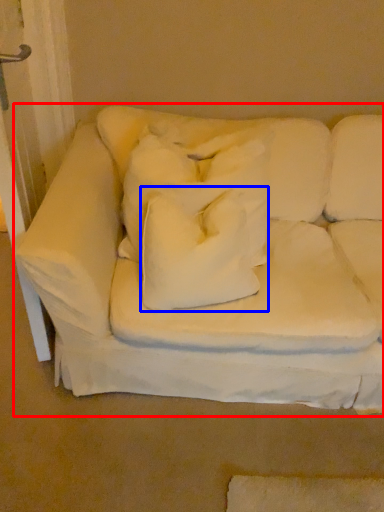
Question: Which object appears closest to the camera in this image, studio couch (highlighted by a red box) or pillow (highlighted by a blue box)?

Choices:
 (A) studio couch
 (B) pillow

Answer: (A)